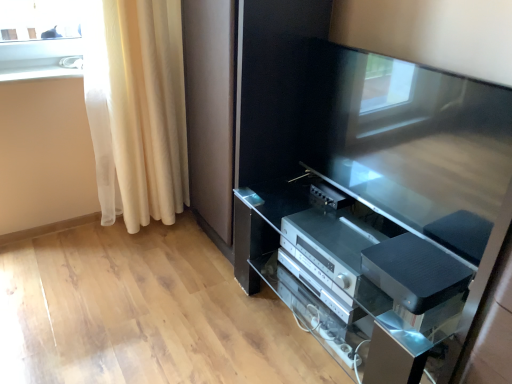
Question: Can you confirm if white glossy window sill at upper left is bigger than satin black tv at center?

Choices:
 (A) no
 (B) yes

Answer: (A)

Question: From the image's perspective, is white glossy window sill at upper left beneath satin black tv at center?

Choices:
 (A) yes
 (B) no

Answer: (B)

Question: From a real-world perspective, is white glossy window sill at upper left on top of satin black tv at center?

Choices:
 (A) no
 (B) yes

Answer: (B)

Question: From the image's perspective, is white glossy window sill at upper left over satin black tv at center?

Choices:
 (A) no
 (B) yes

Answer: (B)

Question: Is satin black tv at center at the back of white glossy window sill at upper left?

Choices:
 (A) no
 (B) yes

Answer: (A)

Question: Can you confirm if white glossy window sill at upper left is wider than satin black tv at center?

Choices:
 (A) no
 (B) yes

Answer: (B)

Question: Can you confirm if silver metallic stereo at lower center, which is counted as the second appliance, starting from the front, is taller than white glossy window sill at upper left?

Choices:
 (A) no
 (B) yes

Answer: (B)

Question: From the image's perspective, is silver metallic stereo at lower center, which is counted as the second appliance, starting from the front, below white glossy window sill at upper left?

Choices:
 (A) no
 (B) yes

Answer: (B)

Question: Could you tell me if silver metallic stereo at lower center, which is counted as the second appliance, starting from the front, is turned towards white glossy window sill at upper left?

Choices:
 (A) yes
 (B) no

Answer: (B)

Question: Is silver metallic stereo at lower center, the first appliance viewed from the back, surrounding white glossy window sill at upper left?

Choices:
 (A) yes
 (B) no

Answer: (B)

Question: Considering the relative sizes of silver metallic stereo at lower center, which is counted as the second appliance, starting from the front, and white glossy window sill at upper left in the image provided, is silver metallic stereo at lower center, which is counted as the second appliance, starting from the front, shorter than white glossy window sill at upper left?

Choices:
 (A) yes
 (B) no

Answer: (B)

Question: Does silver metallic stereo at lower center, which is counted as the second appliance, starting from the front, touch white glossy window sill at upper left?

Choices:
 (A) yes
 (B) no

Answer: (B)

Question: Are silver metallic stereo at lower center, the first appliance viewed from the back, and satin black tv at center beside each other?

Choices:
 (A) yes
 (B) no

Answer: (B)